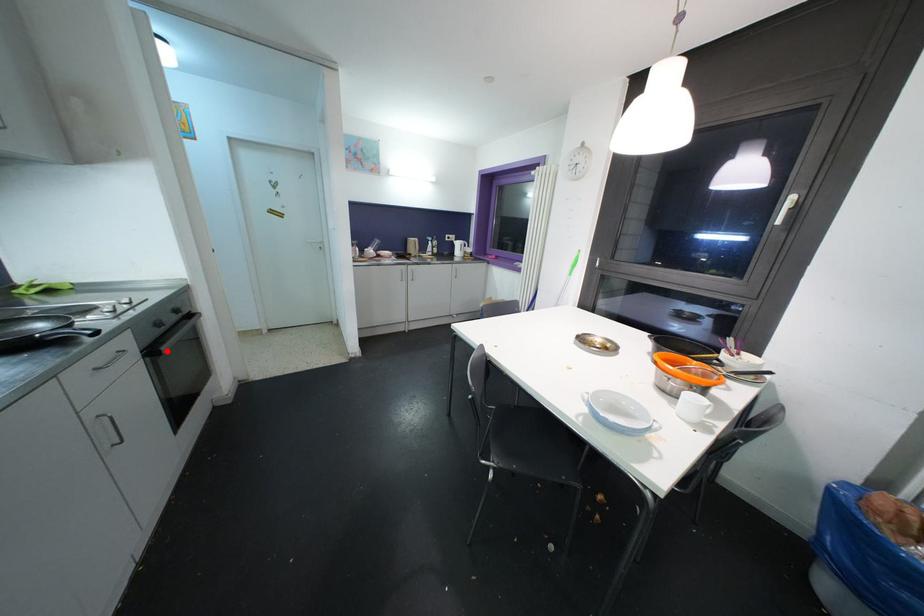
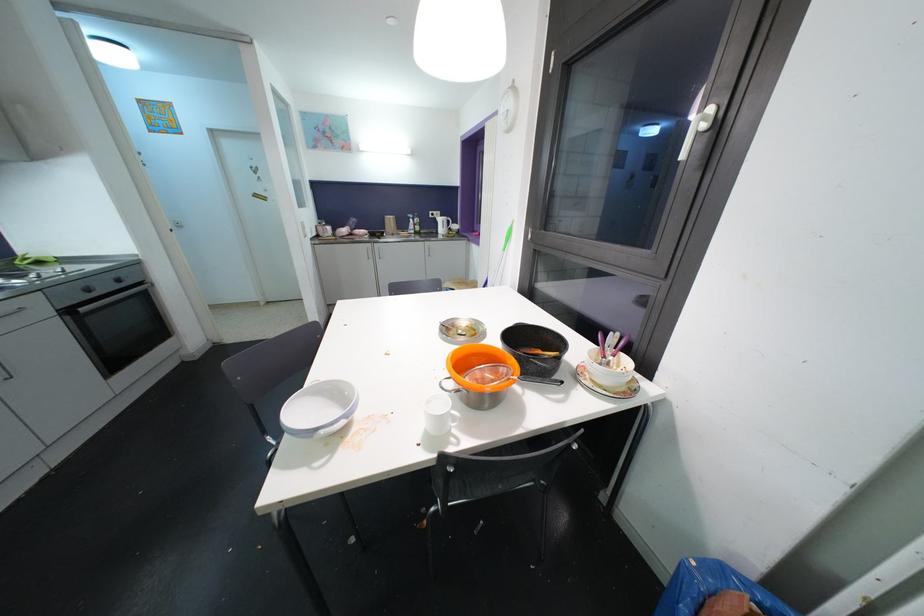
Where in the second image is the point corresponding to the highlighted location from the first image?

(84, 312)